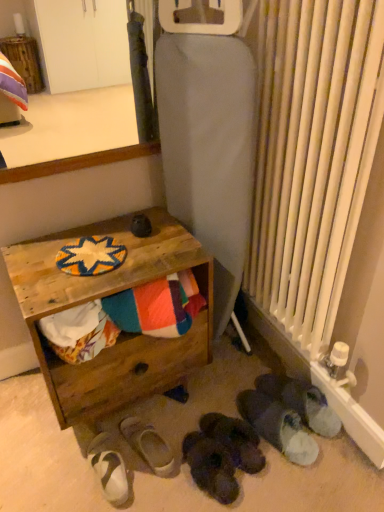
Locate an element on the screen. unoccupied area in front of black suede slippers at lower center, acting as the 4th footwear starting from the left is located at coordinates (243, 494).